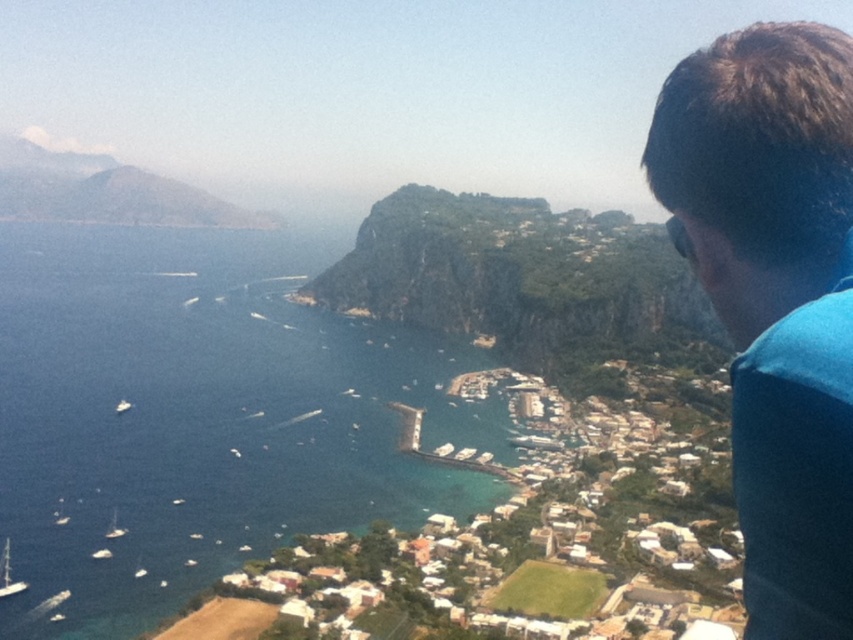
Between blue water at center and white wooden sailboat at lower left, which one is positioned higher?

blue water at center

Does blue water at center have a smaller size compared to white wooden sailboat at lower left?

Incorrect, blue water at center is not smaller in size than white wooden sailboat at lower left.

Between point (126, 356) and point (4, 576), which one is positioned behind?

The point (126, 356) is behind.

Image resolution: width=853 pixels, height=640 pixels. In order to click on blue water at center in this screenshot , I will do `click(202, 417)`.

Can you confirm if blue water at center is positioned to the left of green rock cliff at center?

Yes, blue water at center is to the left of green rock cliff at center.

Does point (242, 385) come in front of point (585, 342)?

Yes, it is in front of point (585, 342).

The image size is (853, 640). I want to click on blue water at center, so click(x=202, y=417).

Is blue fabric at upper right thinner than white matte boat at lower left?

No.

Is point (807, 189) behind point (115, 529)?

No.

Image resolution: width=853 pixels, height=640 pixels. What are the coordinates of `blue fabric at upper right` in the screenshot? It's located at (775, 296).